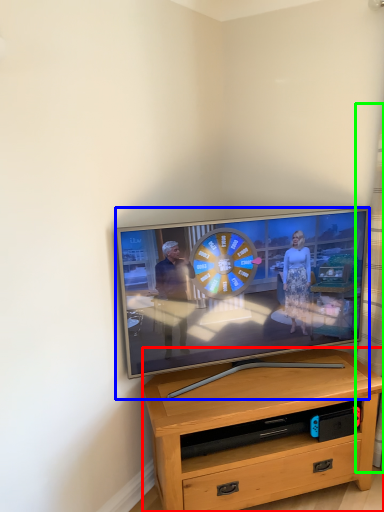
Question: Based on their relative distances, which object is nearer to desk (highlighted by a red box)? Choose from television (highlighted by a blue box) and curtain (highlighted by a green box).

Choices:
 (A) television
 (B) curtain

Answer: (A)